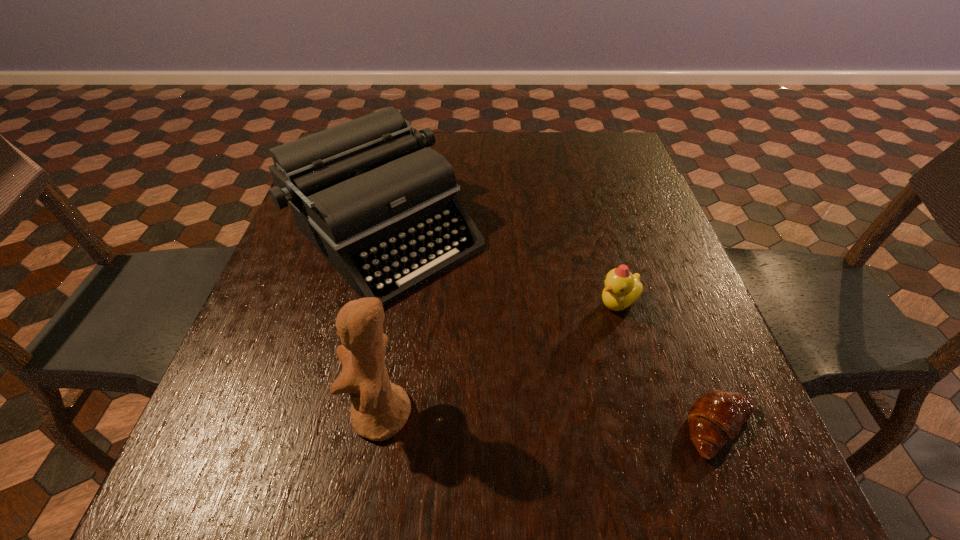
I want to click on vacant space located on the front-facing side of the third tallest object, so click(563, 391).

The image size is (960, 540). I want to click on free region located 0.260m on the front-facing side of the third tallest object, so click(x=546, y=418).

Image resolution: width=960 pixels, height=540 pixels. What are the coordinates of `vacant region located on the front-facing side of the third tallest object` in the screenshot? It's located at (535, 438).

This screenshot has width=960, height=540. What are the coordinates of `blank area located 0.240m on the typing side of the third shortest object` in the screenshot? It's located at (529, 363).

The width and height of the screenshot is (960, 540). In order to click on free region located on the typing side of the third shortest object in this screenshot , I will do `click(589, 418)`.

The image size is (960, 540). Identify the location of free space located on the typing side of the third shortest object. (589, 418).

Locate an element on the screen. The height and width of the screenshot is (540, 960). figurine situated at the near edge is located at coordinates point(380,409).

At what (x,y) coordinates should I click in order to perform the action: click on crescent roll situated at the near edge. Please return your answer as a coordinate pair (x, y). The width and height of the screenshot is (960, 540). Looking at the image, I should click on [716, 417].

Where is `object that is positioned at the left edge`? This screenshot has width=960, height=540. object that is positioned at the left edge is located at coordinates (364, 192).

At what (x,y) coordinates should I click in order to perform the action: click on crescent roll at the right edge. Please return your answer as a coordinate pair (x, y). The height and width of the screenshot is (540, 960). Looking at the image, I should click on (716, 417).